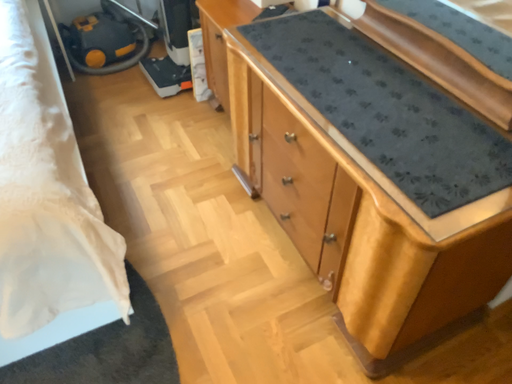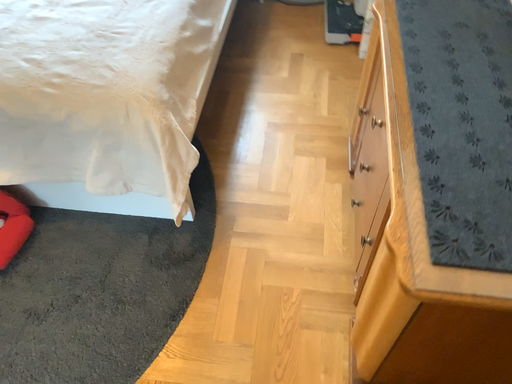
Question: How did the camera likely rotate when shooting the video?

Choices:
 (A) rotated left
 (B) rotated right

Answer: (A)